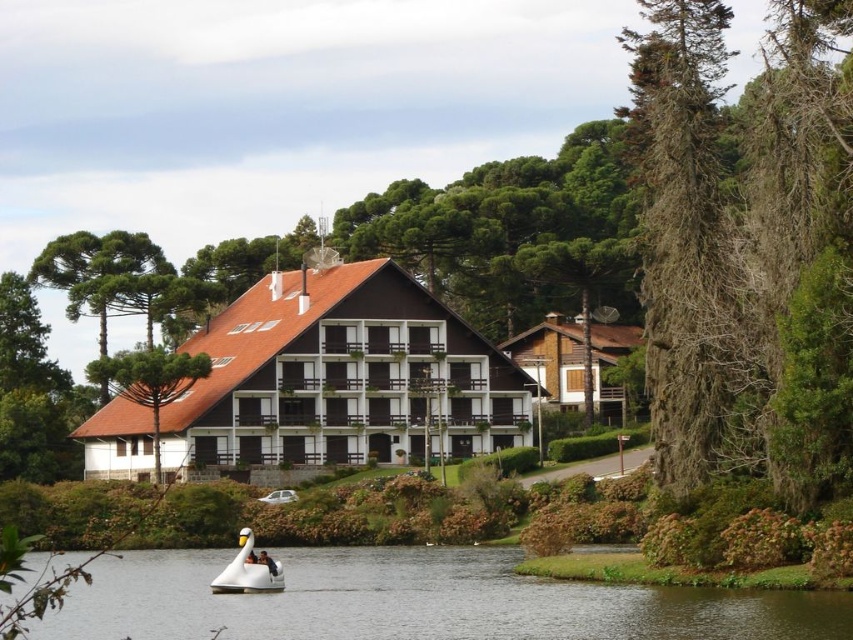
Question: Can you confirm if white glossy water at lower center is positioned to the right of brown wooden house at center-right?

Choices:
 (A) no
 (B) yes

Answer: (A)

Question: Among these points, which one is farthest from the camera?

Choices:
 (A) (822, 604)
 (B) (567, 333)
 (C) (244, 577)

Answer: (B)

Question: Does white glossy water at lower center lie in front of white matte swan boat at lower center?

Choices:
 (A) yes
 (B) no

Answer: (A)

Question: Which of the following is the closest to the observer?

Choices:
 (A) brown wooden house at center-right
 (B) white glossy water at lower center

Answer: (B)

Question: Observing the image, what is the correct spatial positioning of brown wood hotel at center in reference to white matte swan boat at lower center?

Choices:
 (A) right
 (B) left

Answer: (B)

Question: Which point appears farthest from the camera in this image?

Choices:
 (A) (508, 376)
 (B) (131, 563)
 (C) (543, 364)

Answer: (C)